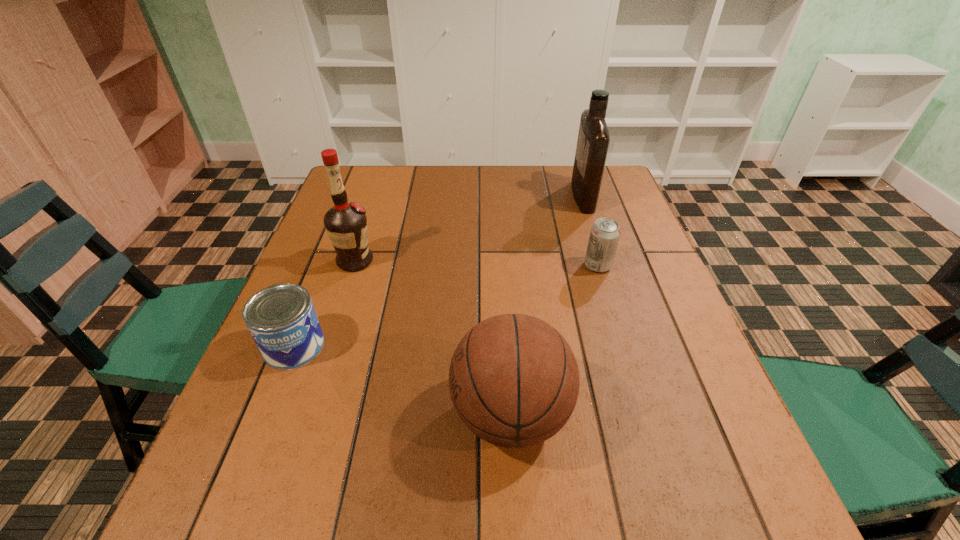
At what (x,y) coordinates should I click in order to perform the action: click on free space between the can and the soda can. Please return your answer as a coordinate pair (x, y). Looking at the image, I should click on (445, 306).

Identify the location of vacant point located between the left liquor and the can. (324, 303).

Where is `free space between the third object from right to left and the can`? free space between the third object from right to left and the can is located at coordinates (402, 380).

What are the coordinates of `empty space that is in between the basketball and the right liquor` in the screenshot? It's located at (546, 305).

I want to click on unoccupied area between the left liquor and the can, so click(324, 303).

Identify the location of empty space between the can and the basketball. The image size is (960, 540). (402, 380).

I want to click on empty space that is in between the can and the farther liquor, so click(439, 271).

Locate an element on the screen. the second closest object relative to the third tallest object is located at coordinates (605, 232).

The height and width of the screenshot is (540, 960). I want to click on object that stands as the third closest to the farther liquor, so click(x=346, y=224).

Find the location of a particular element. The image size is (960, 540). free space that satisfies the following two spatial constraints: 1. on the front and back of the soda can; 2. on the right side of the nearer liquor is located at coordinates (353, 266).